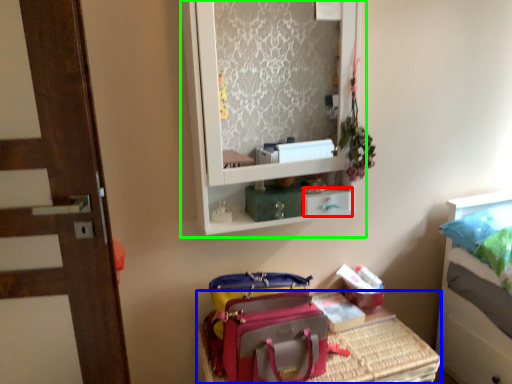
Question: Considering the real-world distances, which object is closest to drawer (highlighted by a red box)? furniture (highlighted by a blue box) or medicine cabinet (highlighted by a green box).

Choices:
 (A) furniture
 (B) medicine cabinet

Answer: (A)